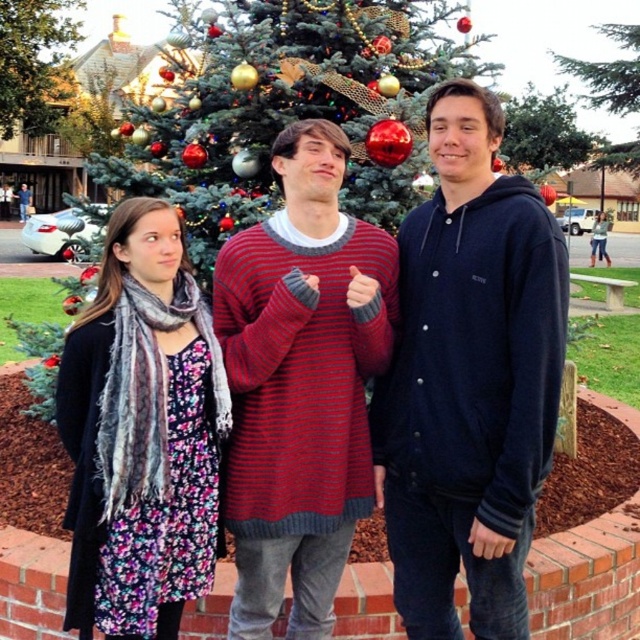
Does striped knit sweater at center appear under green textured pine tree at upper center?

Yes, striped knit sweater at center is below green textured pine tree at upper center.

Can you confirm if striped knit sweater at center is wider than green textured pine tree at upper center?

No, striped knit sweater at center is not wider than green textured pine tree at upper center.

Which is in front, point (508, 524) or point (616, 96)?

Point (508, 524) is in front.

You are a GUI agent. You are given a task and a screenshot of the screen. Output one action in this format:
    pyautogui.click(x=<x>, y=<y>)
    Task: Click on the striped knit sweater at center
    The width and height of the screenshot is (640, 640).
    Given the screenshot: What is the action you would take?
    pyautogui.click(x=468, y=380)

In order to click on striped knit sweater at center in this screenshot , I will do `click(468, 380)`.

Find the location of a particular element. The image size is (640, 640). striped knit sweater at center is located at coordinates (468, 380).

The image size is (640, 640). What are the coordinates of `green leafy tree at upper center` in the screenshot? It's located at (35, 61).

Which of these two, green leafy tree at upper center or green textured pine tree at upper center, stands taller?

green textured pine tree at upper center is taller.

Who is more distant from viewer, (29, 88) or (570, 68)?

The point (29, 88) is behind.

Find the location of a particular element. green leafy tree at upper center is located at coordinates (35, 61).